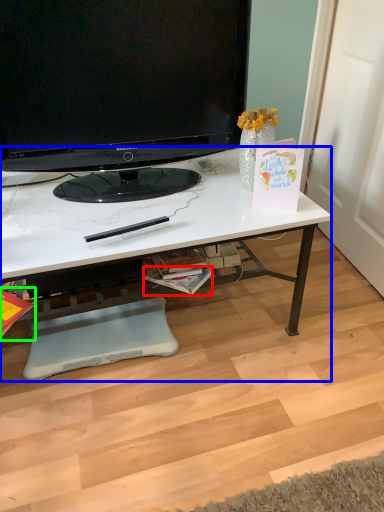
Question: Considering the real-world distances, which object is closest to magazine (highlighted by a red box)? desk (highlighted by a blue box) or magazine (highlighted by a green box).

Choices:
 (A) desk
 (B) magazine

Answer: (A)